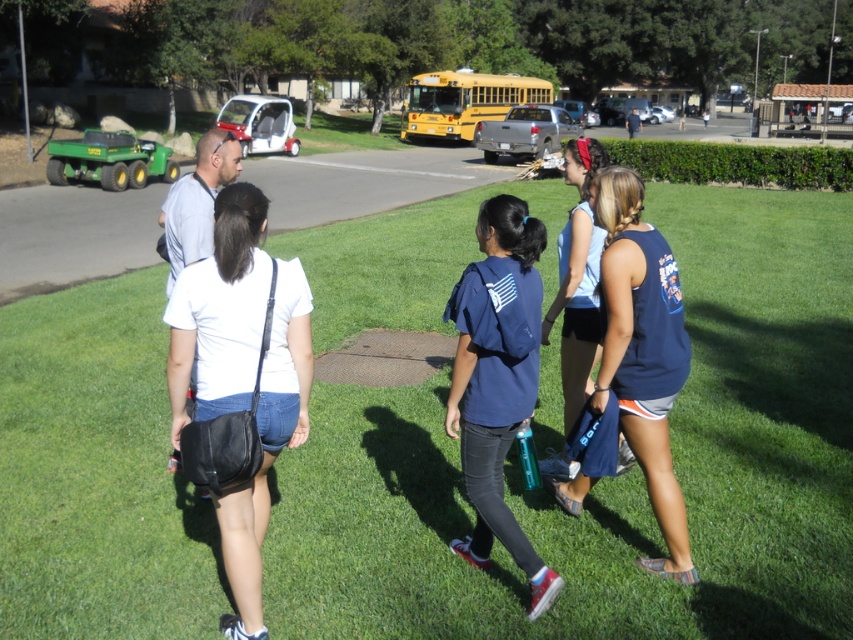
Is navy blue tank top at center-right below blue fabric tank top at center?

Indeed, navy blue tank top at center-right is positioned under blue fabric tank top at center.

Who is positioned more to the left, navy blue tank top at center-right or blue fabric tank top at center?

blue fabric tank top at center

Does point (669, 532) come in front of point (589, 234)?

Yes, it is in front of point (589, 234).

This screenshot has height=640, width=853. I want to click on navy blue tank top at center-right, so click(642, 352).

Identify the location of navy blue t-shirt at center. The height and width of the screenshot is (640, 853). (497, 380).

Can you confirm if navy blue t-shirt at center is positioned to the right of blue fabric tank top at center?

In fact, navy blue t-shirt at center is to the left of blue fabric tank top at center.

Does point (514, 301) come closer to viewer compared to point (579, 307)?

Yes.

Where is `navy blue t-shirt at center`? navy blue t-shirt at center is located at coordinates (497, 380).

Does green grass at center appear under navy blue tank top at center-right?

No.

Does point (193, 497) lie behind point (672, 314)?

Yes, point (193, 497) is farther from viewer.

Describe the element at coordinates (611, 477) in the screenshot. I see `green grass at center` at that location.

Identify the location of green grass at center. This screenshot has width=853, height=640. (611, 477).